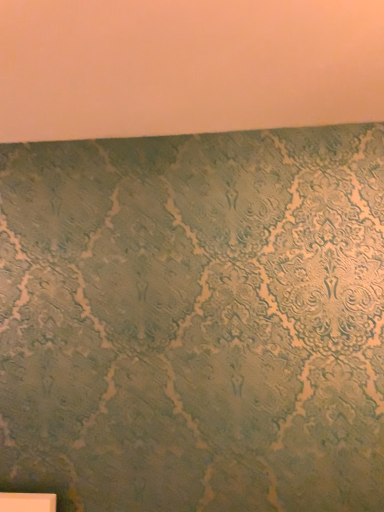
What do you see at coordinates (186, 66) in the screenshot? I see `matte green textured wall at upper center` at bounding box center [186, 66].

At what (x,y) coordinates should I click in order to perform the action: click on matte green textured wall at upper center. Please return your answer as a coordinate pair (x, y). Image resolution: width=384 pixels, height=512 pixels. Looking at the image, I should click on (186, 66).

Find the location of a particular element. The image size is (384, 512). matte green textured wall at upper center is located at coordinates (186, 66).